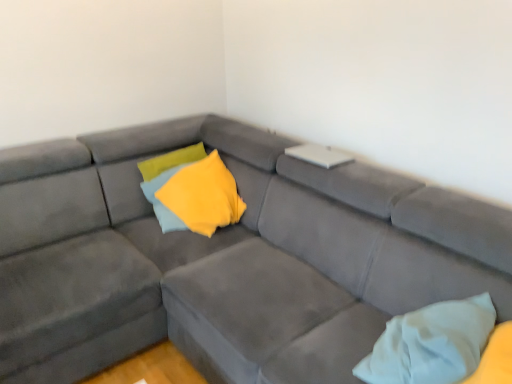
Question: From a real-world perspective, is white soft pillow at lower right, arranged as the 1th pillow when viewed from the right, positioned above or below suede gray couch at center?

Choices:
 (A) below
 (B) above

Answer: (B)

Question: Considering the positions of white soft pillow at lower right, placed as the second pillow when sorted from left to right, and suede gray couch at center in the image, is white soft pillow at lower right, placed as the second pillow when sorted from left to right, taller or shorter than suede gray couch at center?

Choices:
 (A) tall
 (B) short

Answer: (B)

Question: Based on their relative distances, which object is nearer to the yellow soft fabric pillow at center, the first pillow when ordered from top to bottom?

Choices:
 (A) suede gray couch at center
 (B) white soft pillow at lower right, the 2th pillow viewed from the back

Answer: (A)

Question: Based on their relative distances, which object is farther from the white soft pillow at lower right, the first pillow from the bottom?

Choices:
 (A) suede gray couch at center
 (B) yellow soft fabric pillow at center, positioned as the second pillow in bottom-to-top order

Answer: (B)